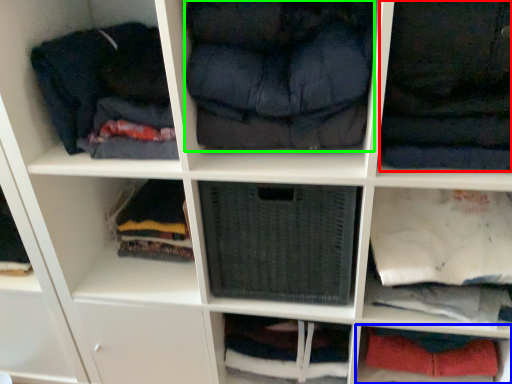
Question: Which object is positioned closest to clothing (highlighted by a red box)? Select from cabinet (highlighted by a blue box) and clothing (highlighted by a green box).

Choices:
 (A) cabinet
 (B) clothing

Answer: (B)